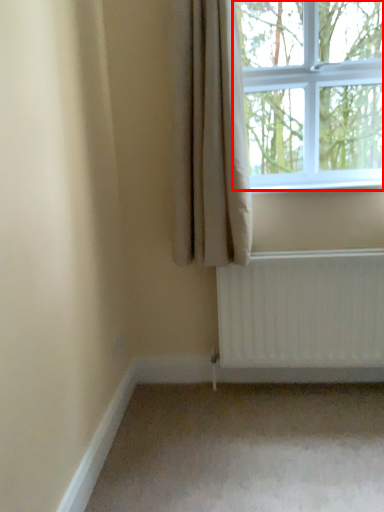
Question: From the image, what is the correct spatial relationship of window (annotated by the red box) in relation to curtain?

Choices:
 (A) right
 (B) left

Answer: (A)